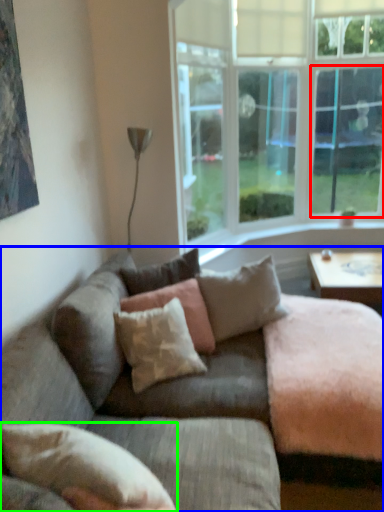
Question: Which object is positioned farthest from window screen (highlighted by a red box)? Select from studio couch (highlighted by a blue box) and pillow (highlighted by a green box).

Choices:
 (A) studio couch
 (B) pillow

Answer: (B)